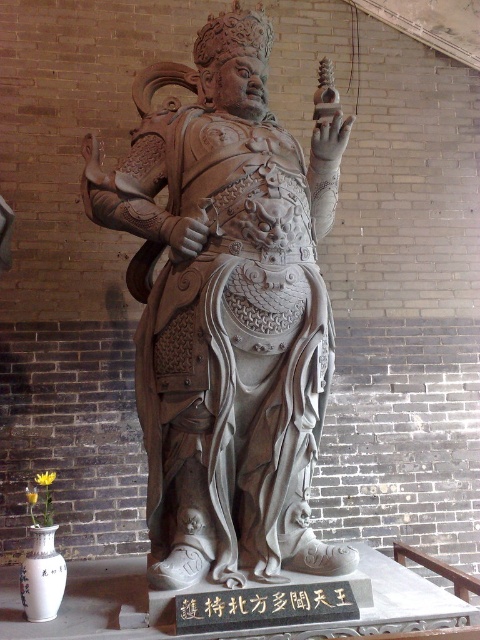
Question: Which of the following is the farthest from the observer?

Choices:
 (A) (290, 618)
 (B) (204, 339)

Answer: (B)

Question: Can you confirm if gray stone statue at center is positioned to the right of black stone text at center?

Choices:
 (A) no
 (B) yes

Answer: (A)

Question: Which point is farther to the camera?

Choices:
 (A) (214, 193)
 (B) (336, 593)

Answer: (A)

Question: Can you confirm if gray stone statue at center is positioned below black stone text at center?

Choices:
 (A) no
 (B) yes

Answer: (A)

Question: Which object is farther from the camera taking this photo?

Choices:
 (A) gray stone statue at center
 (B) black stone text at center

Answer: (A)

Question: Is gray stone statue at center positioned before black stone text at center?

Choices:
 (A) yes
 (B) no

Answer: (B)